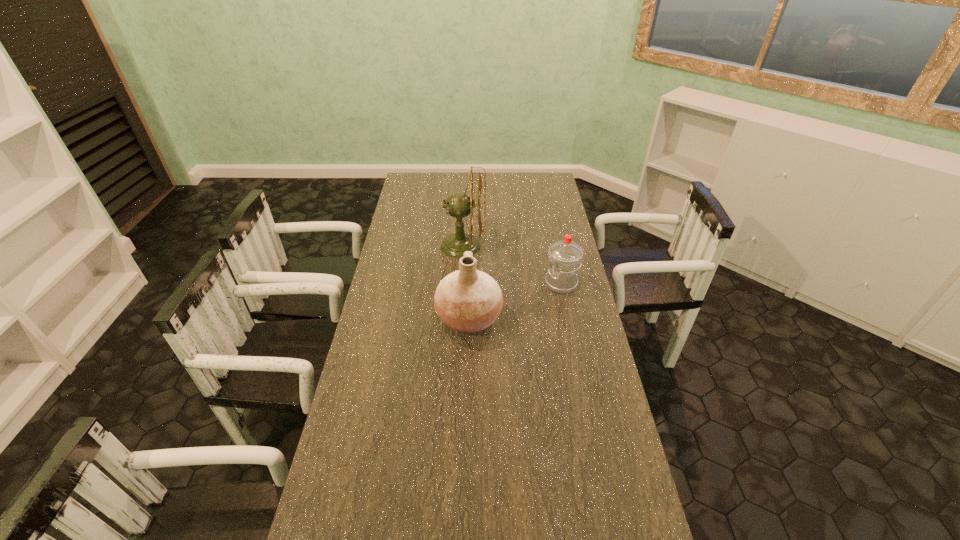
Find the location of a particular element. The image size is (960, 540). object located in the right edge section of the desktop is located at coordinates (565, 256).

The height and width of the screenshot is (540, 960). I want to click on vacant space at the far edge of the desktop, so click(x=507, y=187).

This screenshot has width=960, height=540. In the image, there is a desktop. In order to click on vacant space at the left edge in this screenshot , I will do `click(352, 498)`.

At what (x,y) coordinates should I click in order to perform the action: click on vacant region at the right edge of the desktop. Please return your answer as a coordinate pair (x, y). The width and height of the screenshot is (960, 540). Looking at the image, I should click on (546, 290).

Locate an element on the screen. vacant space at the far left corner of the desktop is located at coordinates (419, 188).

Locate an element on the screen. The image size is (960, 540). free space between the rightmost object and the nearest object is located at coordinates (515, 301).

At what (x,y) coordinates should I click in order to perform the action: click on free space between the nearest object and the water bottle. Please return your answer as a coordinate pair (x, y). Image resolution: width=960 pixels, height=540 pixels. Looking at the image, I should click on (515, 301).

Select which object appears as the second closest to the shortest object. Please provide its 2D coordinates. Your answer should be formatted as a tuple, i.e. [(x, y)], where the tuple contains the x and y coordinates of a point satisfying the conditions above.

[(458, 205)]

Identify the location of the closest object relative to the fan. (468, 300).